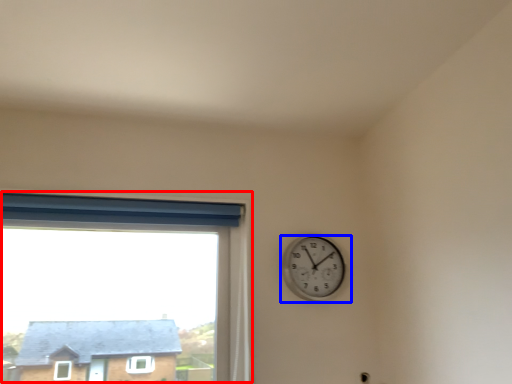
Question: Which object appears closest to the camera in this image, window (highlighted by a red box) or wall clock (highlighted by a blue box)?

Choices:
 (A) window
 (B) wall clock

Answer: (A)